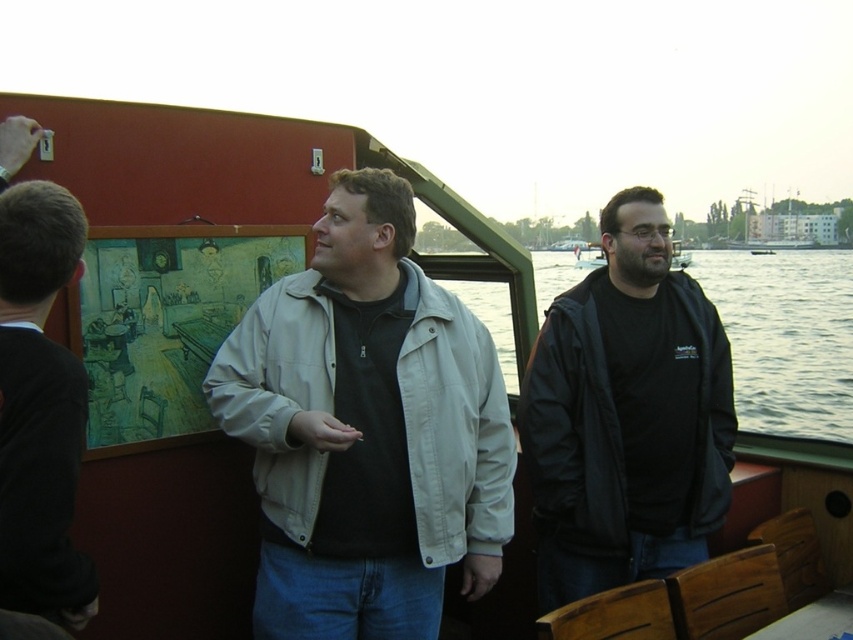
You are standing on the boat and want to hand a document to the person wearing the black matte jacket at center. If your arm can reach 1.5 meters, can you reach them?

The black matte jacket at center is 3.10 meters away from the viewer. Since your arm can only reach 1.5 meters, you cannot reach them directly and will need to move closer or use another method to hand the document.

You are a photographer on the boat and want to take a picture of the black matte jacket at center and the clear water at right. Which object is closer to the edge of the boat?

The black matte jacket at center is positioned under clear water at right, so the black matte jacket at center is closer to the edge of the boat.

You are a photographer trying to capture both the black matte jacket at center and the dark gray sweater at left in a single frame. Based on their positions, can you fit both in the shot without moving the camera?

The black matte jacket at center might be wider than dark gray sweater at left, so there is a possibility that both can be captured in the frame if the camera angle allows for the width difference.